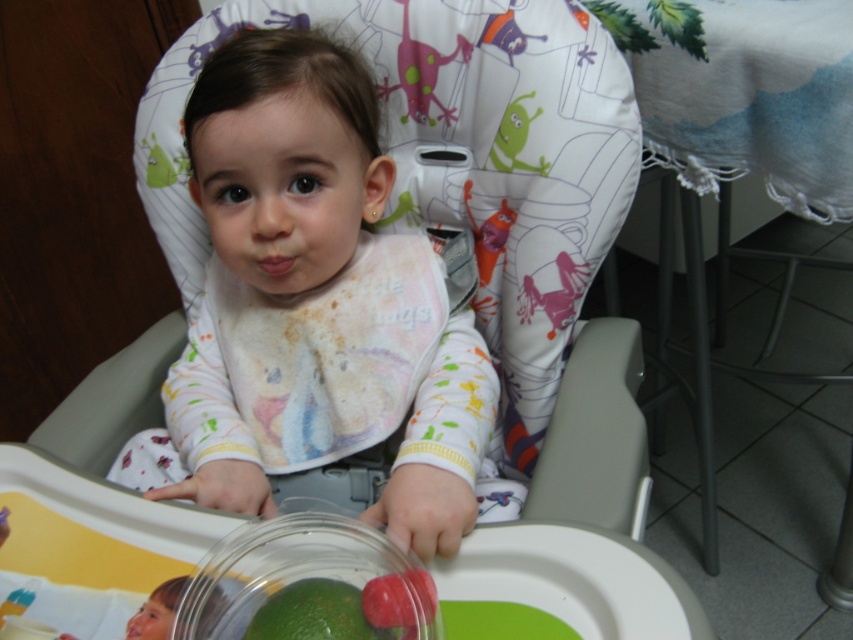
Question: Which object appears closest to the camera in this image?

Choices:
 (A) transparent glass bowl at lower center
 (B) green matte lime at lower center

Answer: (A)

Question: Which object is closer to the camera taking this photo?

Choices:
 (A) white soft bib at center
 (B) green matte lime at lower center
 (C) green rubber toy at upper right

Answer: (B)

Question: Can you confirm if white soft bib at center is wider than green rubber toy at upper right?

Choices:
 (A) yes
 (B) no

Answer: (A)

Question: Which point is closer to the camera taking this photo?

Choices:
 (A) (337, 368)
 (B) (509, 164)
 (C) (198, 589)
 (D) (294, 634)

Answer: (D)

Question: Is transparent glass bowl at lower center positioned before green rubber toy at upper right?

Choices:
 (A) yes
 (B) no

Answer: (A)

Question: Does white soft bib at center have a smaller size compared to transparent glass bowl at lower center?

Choices:
 (A) no
 (B) yes

Answer: (A)